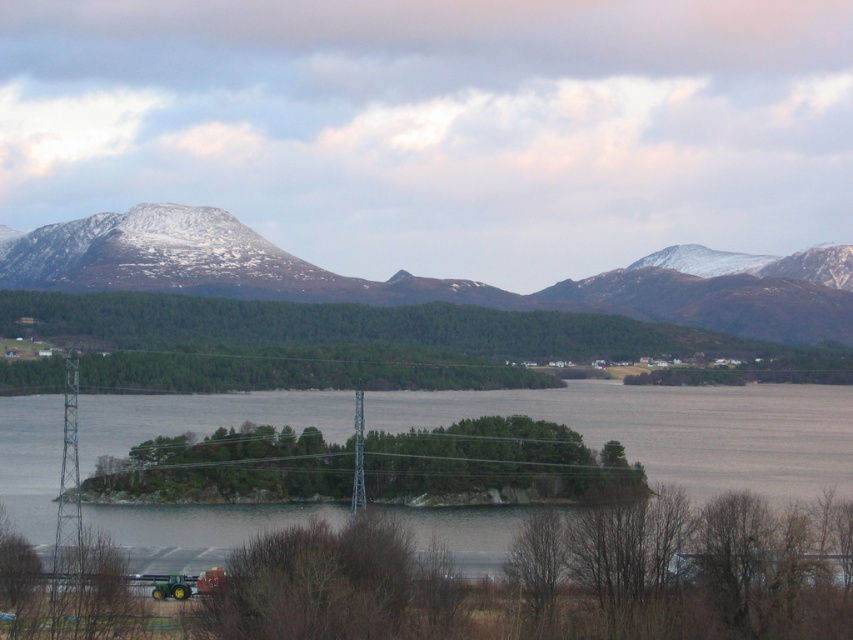
You are standing at the point labeled as point [674,429]. What do you see directly in front of you?

The point labeled point [674,429] corresponds to clear water at center, so you would see clear water at center directly in front of you.